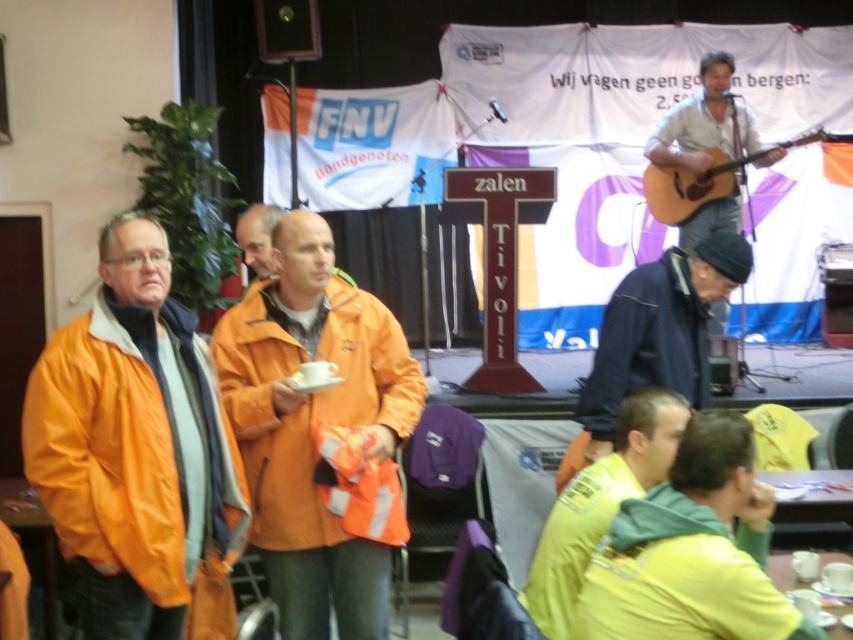
You are a photographer at the event and need to capture a photo that includes both the dark blue jacket at lower right and the acoustic wood guitar at upper right. Which object should you adjust your camera angle to focus on first to ensure both are in frame?

The dark blue jacket at lower right is taller than the acoustic wood guitar at upper right, so you should focus on the dark blue jacket at lower right first to ensure the entire height of both objects fits within the frame.

In the scene shown: You are standing at the center of the stage and want to move towards the point that is closer to the camera. Which point should you head towards, point (729, 141) or point (648, 179)?

You should head towards point (729, 141) because it is closer to the camera than point (648, 179).

You are a photographer at the event and need to position a camera to capture both guitars. Since the white matte guitar at upper right is taller than the acoustic wood guitar at upper right, which guitar should you place closer to the camera to ensure both are fully visible in the frame?

You should place the white matte guitar at upper right closer to the camera because it is taller than the acoustic wood guitar at upper right. This will help ensure both guitars are fully visible in the frame without cropping either.